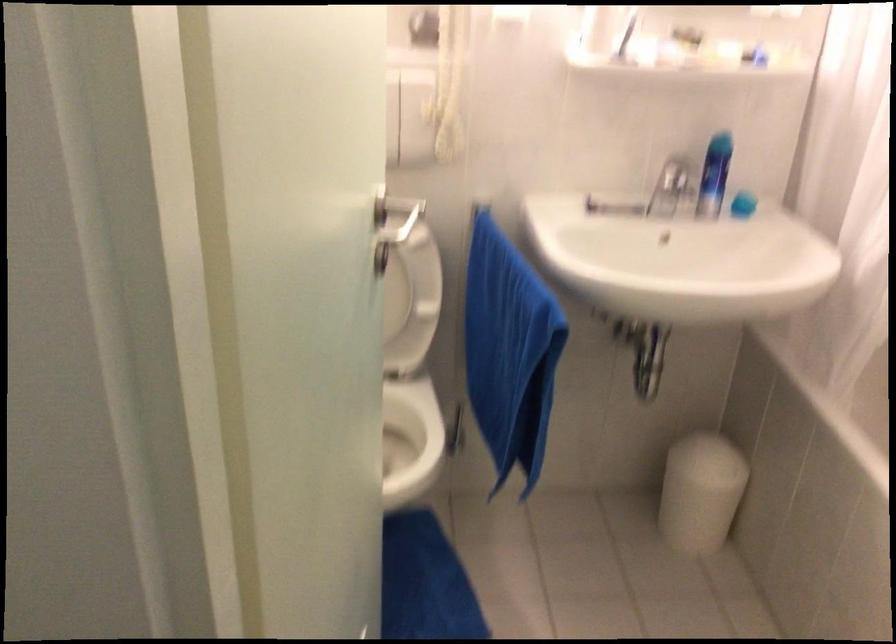
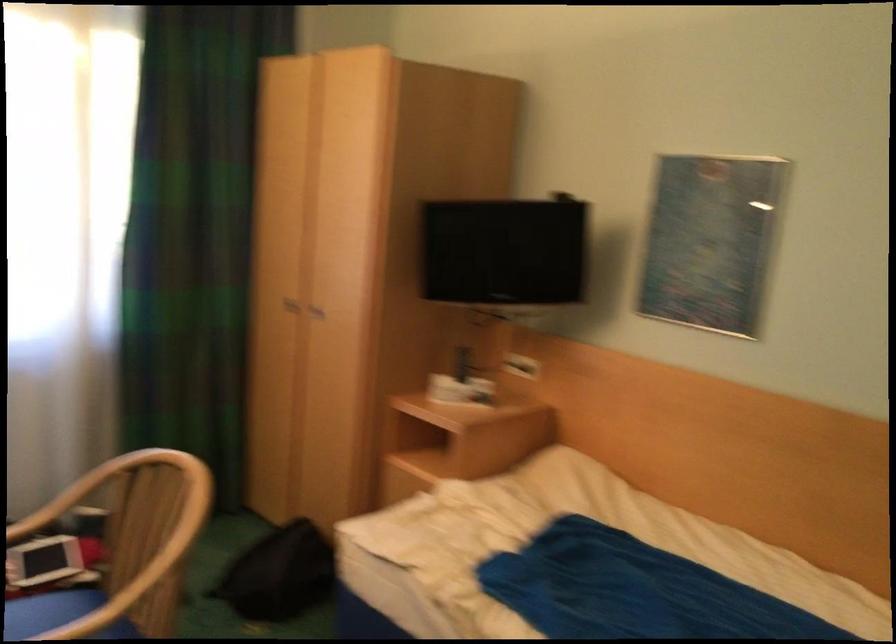
Question: How did the camera likely rotate?

Choices:
 (A) Left
 (B) Right
 (C) Up
 (D) Down

Answer: (A)